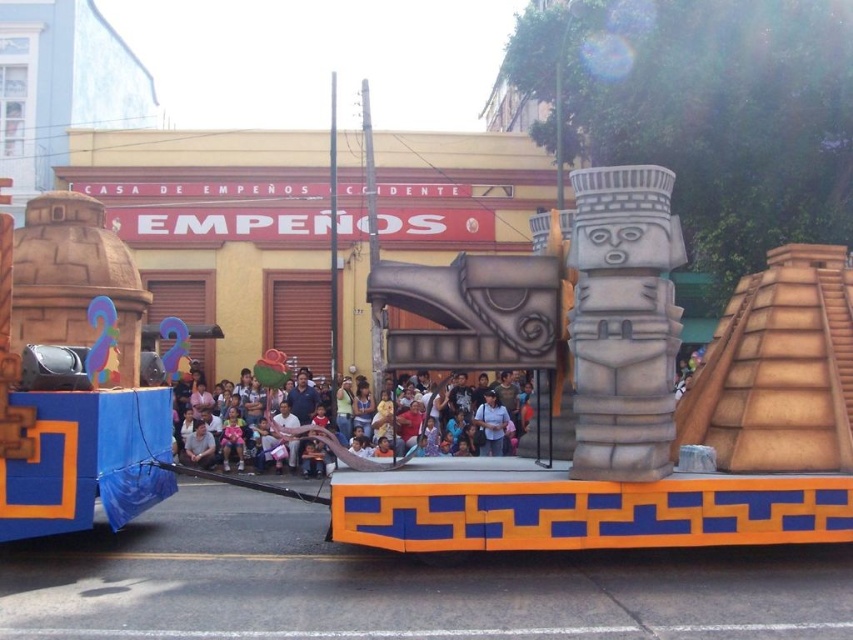
Looking at this image, between light brown fabric at center and matte pink shirt at center, which one appears on the right side from the viewer's perspective?

From the viewer's perspective, matte pink shirt at center appears more on the right side.

Does point (334, 448) come behind point (492, 456)?

That is False.

Image resolution: width=853 pixels, height=640 pixels. In order to click on light brown fabric at center in this screenshot , I will do `click(335, 445)`.